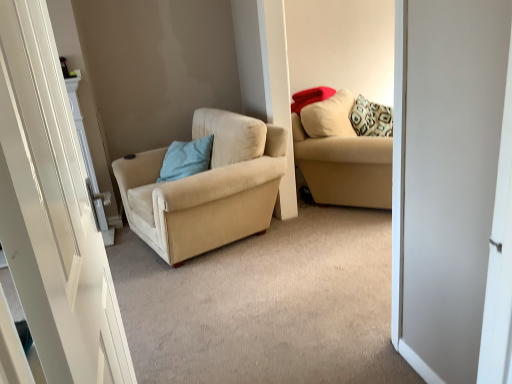
Question: Does matte red pillow at upper right, marked as the first pillow in a top-to-bottom arrangement, appear on the left side of beige fabric couch at upper right?

Choices:
 (A) no
 (B) yes

Answer: (B)

Question: From a real-world perspective, does matte red pillow at upper right, marked as the first pillow in a top-to-bottom arrangement, sit lower than beige fabric couch at upper right?

Choices:
 (A) yes
 (B) no

Answer: (B)

Question: From a real-world perspective, is matte red pillow at upper right, which ranks as the second pillow in left-to-right order, on beige fabric couch at upper right?

Choices:
 (A) yes
 (B) no

Answer: (A)

Question: Is beige fabric couch at upper right a part of matte red pillow at upper right, which ranks as the second pillow in left-to-right order?

Choices:
 (A) yes
 (B) no

Answer: (B)

Question: Is matte red pillow at upper right, placed as the 2th pillow when sorted from bottom to top, at the right side of beige fabric couch at upper right?

Choices:
 (A) no
 (B) yes

Answer: (A)

Question: From a real-world perspective, is beige fabric couch at upper right on white glossy door at left?

Choices:
 (A) yes
 (B) no

Answer: (B)

Question: Is beige fabric couch at upper right positioned in front of white glossy door at left?

Choices:
 (A) yes
 (B) no

Answer: (B)

Question: Considering the relative sizes of beige fabric couch at upper right and white glossy door at left in the image provided, is beige fabric couch at upper right taller than white glossy door at left?

Choices:
 (A) no
 (B) yes

Answer: (A)

Question: Is beige fabric couch at upper right facing away from white glossy door at left?

Choices:
 (A) no
 (B) yes

Answer: (A)

Question: Is beige fabric couch at upper right at the right side of white glossy door at left?

Choices:
 (A) no
 (B) yes

Answer: (B)

Question: Is there a large distance between beige fabric couch at upper right and white glossy door at left?

Choices:
 (A) no
 (B) yes

Answer: (B)

Question: From the image's perspective, is matte red pillow at upper right, marked as the first pillow in a top-to-bottom arrangement, under beige fabric chair at center?

Choices:
 (A) yes
 (B) no

Answer: (B)